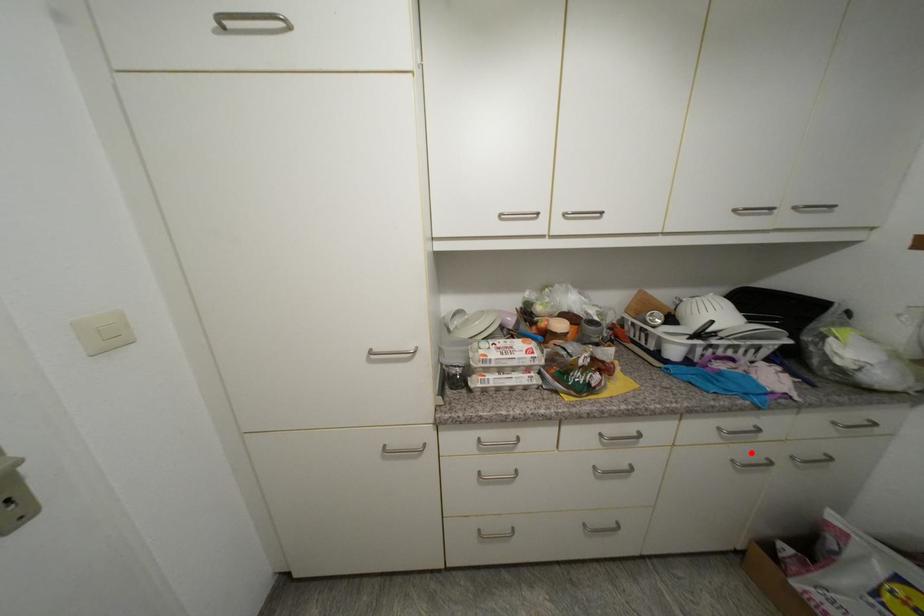
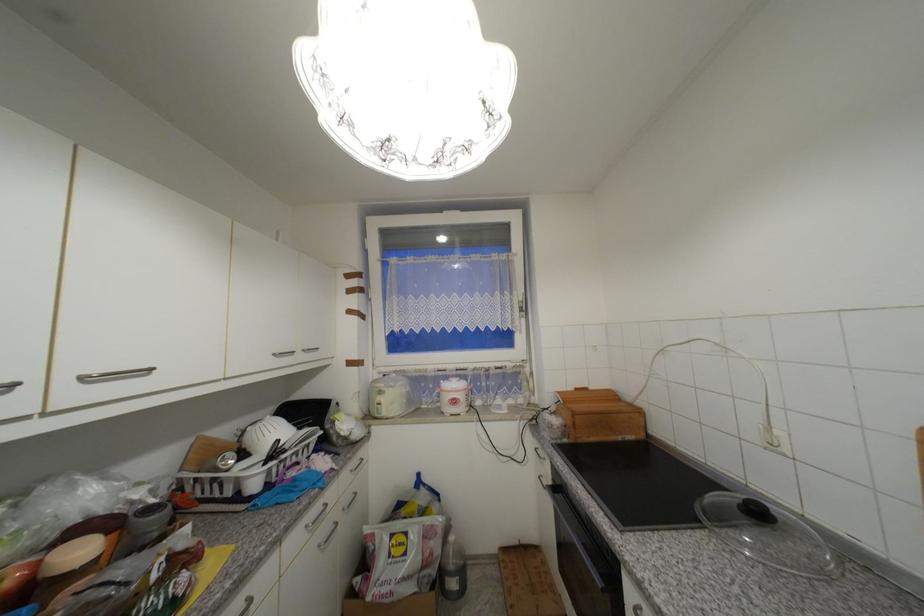
Where in the second image is the point corresponding to the highlighted location from the first image?

(330, 531)